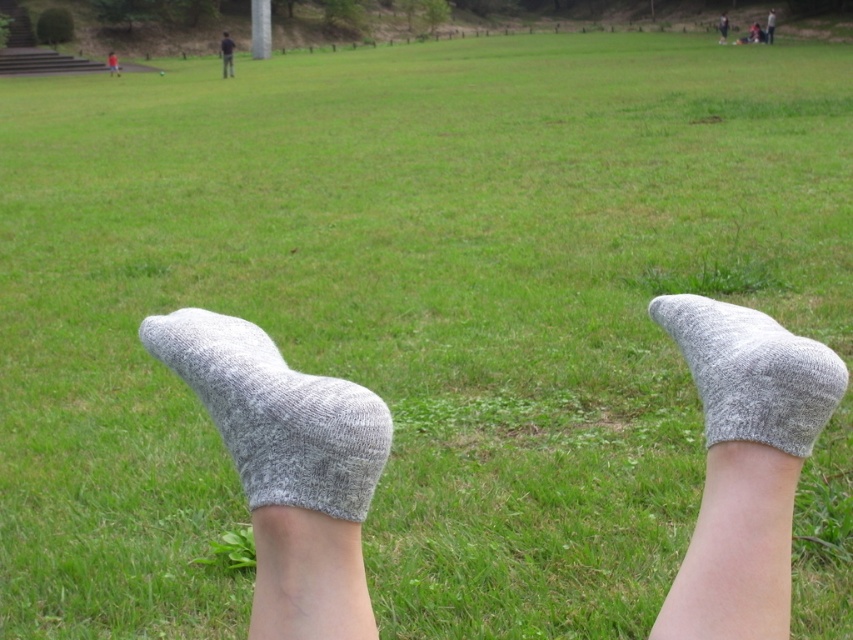
Question: Which of the following is the farthest from the observer?

Choices:
 (A) gray knitted socks at lower center
 (B) red shirt at center
 (C) dark blue jeans at upper right
 (D) gray knitted sock at lower center

Answer: (C)

Question: Is dark blue jeans at upper center below dark blue jeans at upper right?

Choices:
 (A) yes
 (B) no

Answer: (A)

Question: Does dark blue jeans at upper center appear on the left side of red shirt at center?

Choices:
 (A) no
 (B) yes

Answer: (A)

Question: Which point appears closest to the camera in this image?

Choices:
 (A) (109, 68)
 (B) (276, 352)

Answer: (B)

Question: From the image, what is the correct spatial relationship of gray knitted socks at lower center in relation to dark blue jeans at upper center?

Choices:
 (A) right
 (B) left

Answer: (A)

Question: Among these objects, which one is nearest to the camera?

Choices:
 (A) gray knitted socks at lower center
 (B) dark blue jeans at upper right

Answer: (A)